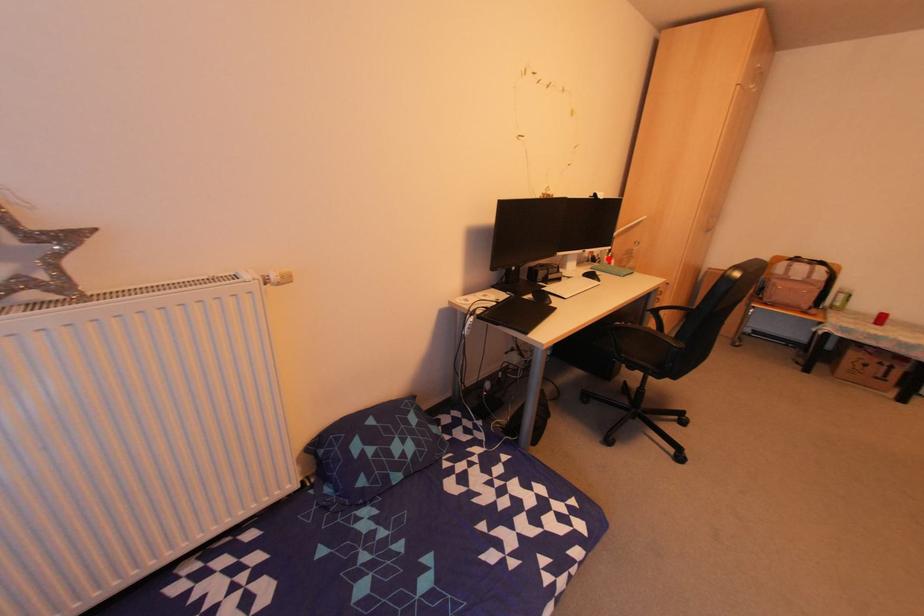
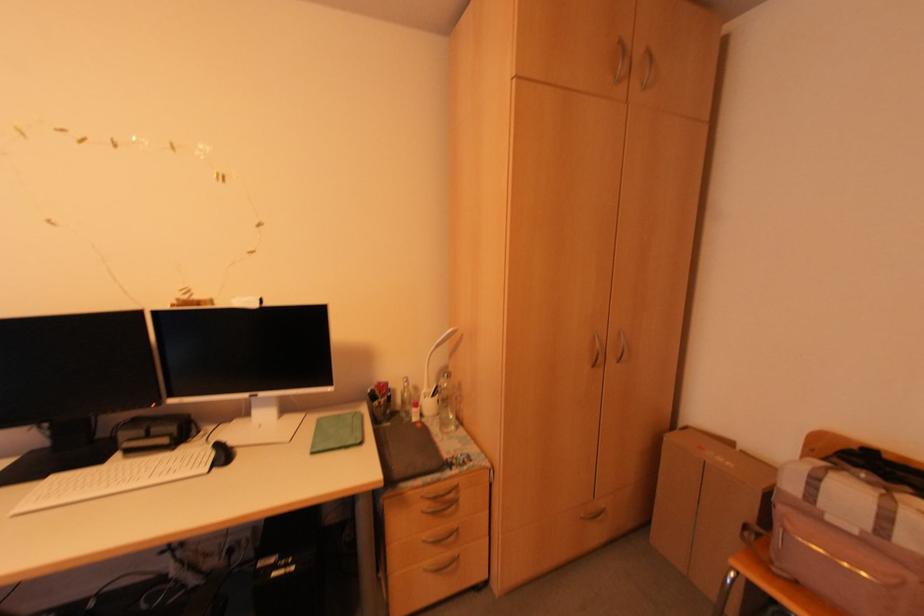
Locate, in the second image, the point that corresponds to the highlighted location in the first image.

(431, 395)